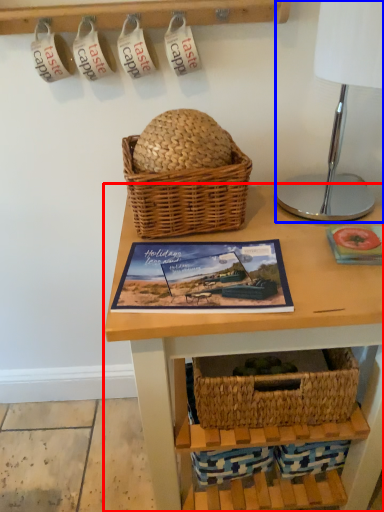
Question: Which point is closer to the camera, table (highlighted by a red box) or table lamp (highlighted by a blue box)?

Choices:
 (A) table
 (B) table lamp

Answer: (B)